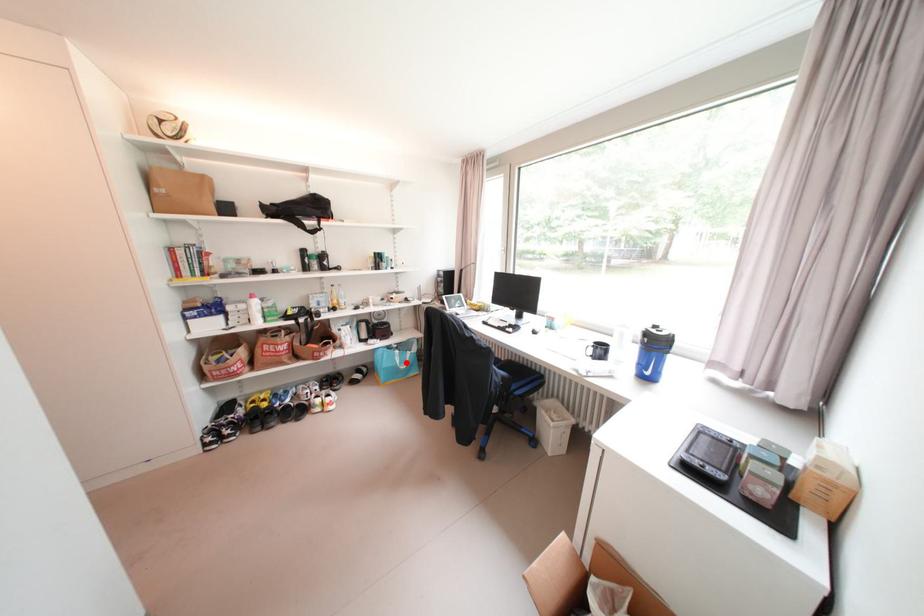
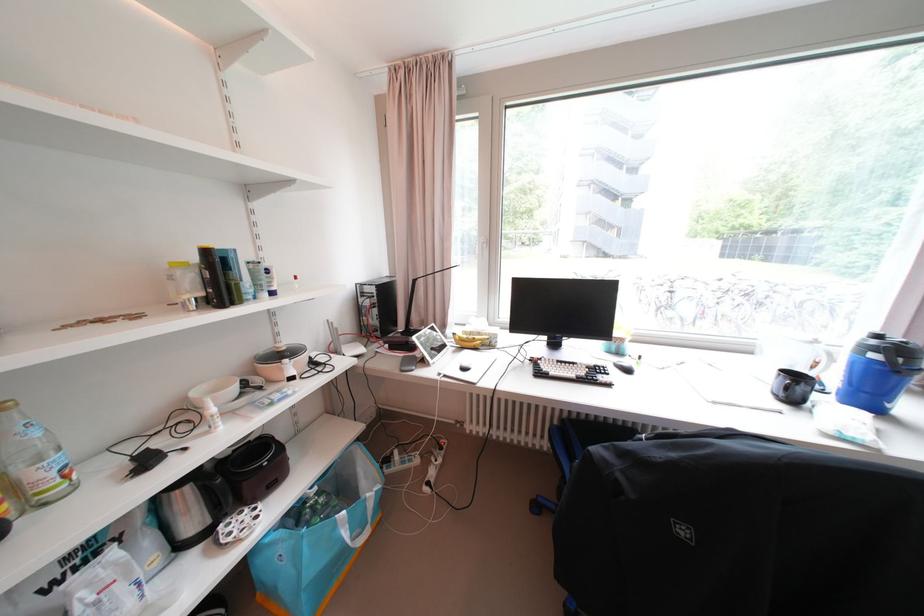
Question: I am providing you with two images of the same scene from different viewpoints. In image1, a red point is highlighted. Considering the same 3D point in image2, which of the following is correct?

Choices:
 (A) It is closer
 (B) It is farther

Answer: (B)